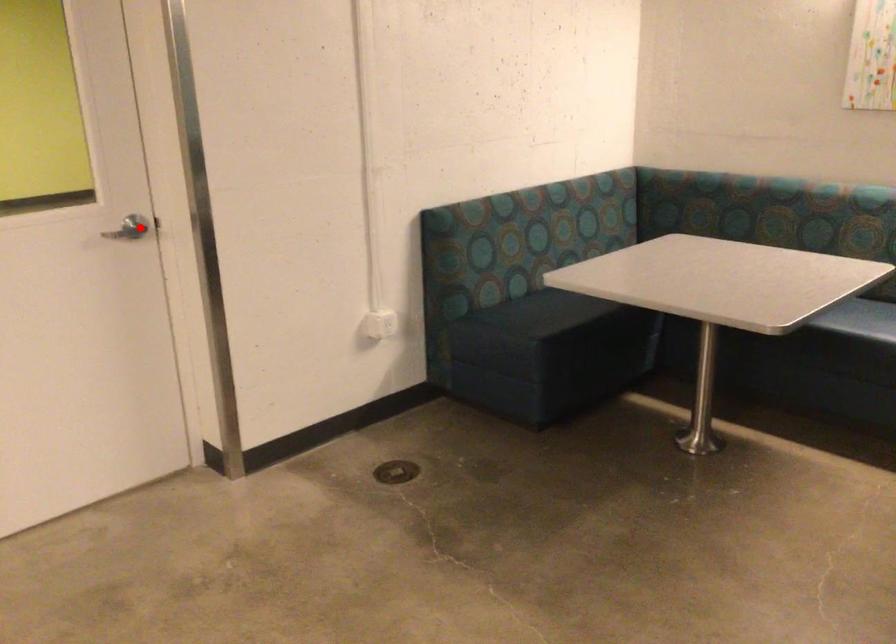
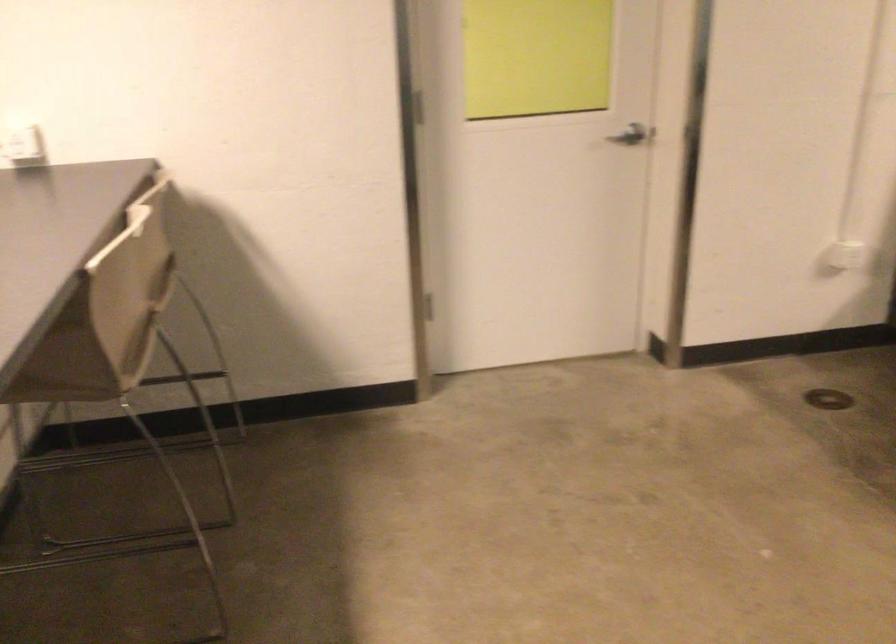
In the second image, find the point that corresponds to the highlighted location in the first image.

(629, 136)